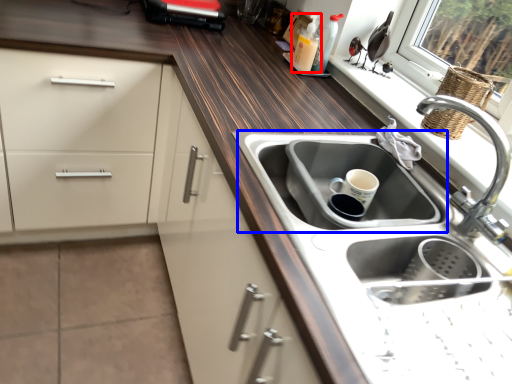
Question: Which of the following is the closest to the observer, bottle (highlighted by a red box) or sink (highlighted by a blue box)?

Choices:
 (A) bottle
 (B) sink

Answer: (B)